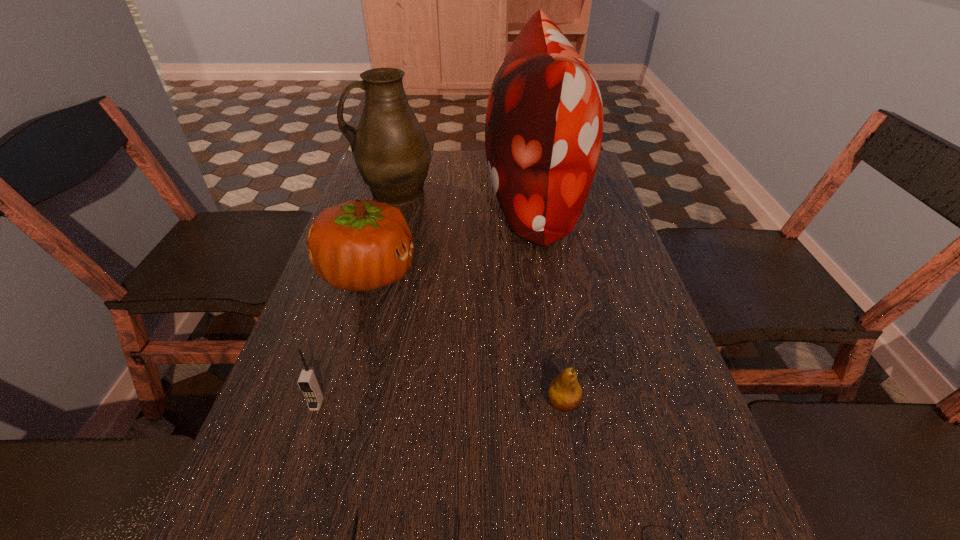
In order to click on free region at the left edge in this screenshot , I will do `click(367, 195)`.

This screenshot has width=960, height=540. In the image, there is a desktop. Find the location of `vacant space at the right edge`. vacant space at the right edge is located at coordinates (582, 309).

What are the coordinates of `empty space that is in between the pear and the sixth shortest object` in the screenshot? It's located at [478, 298].

Image resolution: width=960 pixels, height=540 pixels. Find the location of `empty space that is in between the cellular telephone and the sixth shortest object`. empty space that is in between the cellular telephone and the sixth shortest object is located at coordinates (355, 298).

This screenshot has width=960, height=540. What are the coordinates of `free space between the cellular telephone and the pear` in the screenshot? It's located at (440, 403).

I want to click on free space between the pumpkin and the tallest object, so click(x=451, y=236).

Locate which object is the fifth closest to the sixth shortest object. Please provide its 2D coordinates. Your answer should be formatted as a tuple, i.e. [(x, y)], where the tuple contains the x and y coordinates of a point satisfying the conditions above.

[(356, 521)]

Select which object appears as the second closest to the fifth shortest object. Please provide its 2D coordinates. Your answer should be formatted as a tuple, i.e. [(x, y)], where the tuple contains the x and y coordinates of a point satisfying the conditions above.

[(544, 121)]

Locate an element on the screen. free location that satisfies the following two spatial constraints: 1. on the side of the pumpkin with the cute face; 2. on the front-facing side of the cellular telephone is located at coordinates [x=330, y=403].

You are a GUI agent. You are given a task and a screenshot of the screen. Output one action in this format:
    pyautogui.click(x=<x>, y=<y>)
    Task: Click on the free spot that satisfies the following two spatial constraints: 1. on the front-facing side of the cellular telephone; 2. on the left side of the pear
    
    Given the screenshot: What is the action you would take?
    pyautogui.click(x=317, y=403)